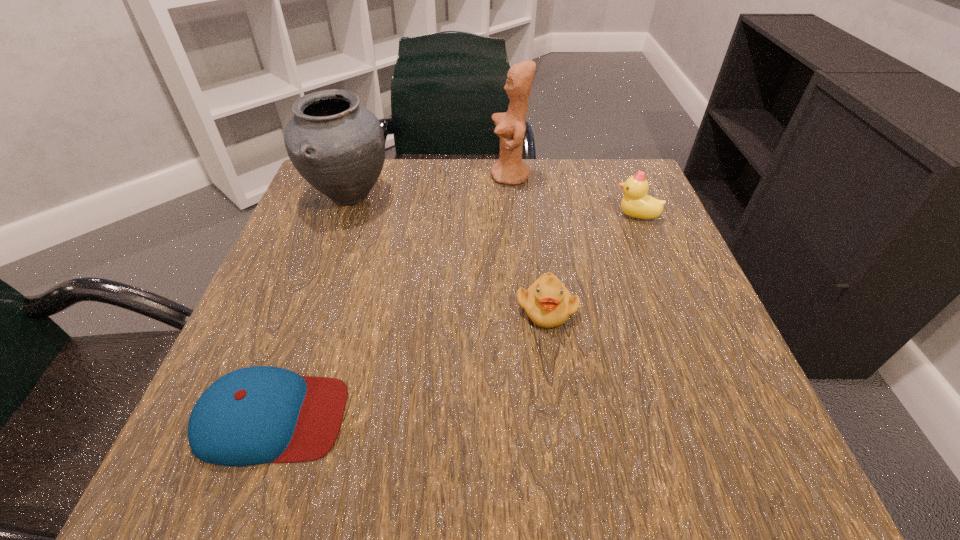
The image size is (960, 540). Identify the location of the tallest object. click(510, 169).

What are the coordinates of `urn` in the screenshot? It's located at (337, 145).

Find the location of a particular element. This screenshot has height=540, width=960. the right duckling is located at coordinates (636, 203).

Identify the location of the rightmost object. (636, 203).

Where is `the second shortest object`? This screenshot has width=960, height=540. the second shortest object is located at coordinates (547, 302).

Where is `the left duckling`? Image resolution: width=960 pixels, height=540 pixels. the left duckling is located at coordinates (547, 302).

Identify the location of the shortest object. This screenshot has width=960, height=540. (255, 415).

Find the location of a particular element. The height and width of the screenshot is (540, 960). the nearest object is located at coordinates (255, 415).

Where is `vacant point located 0.400m on the front-facing side of the figurine`? The image size is (960, 540). vacant point located 0.400m on the front-facing side of the figurine is located at coordinates (320, 176).

Find the location of a particular element. Image resolution: width=960 pixels, height=540 pixels. free space located on the front-facing side of the figurine is located at coordinates (367, 176).